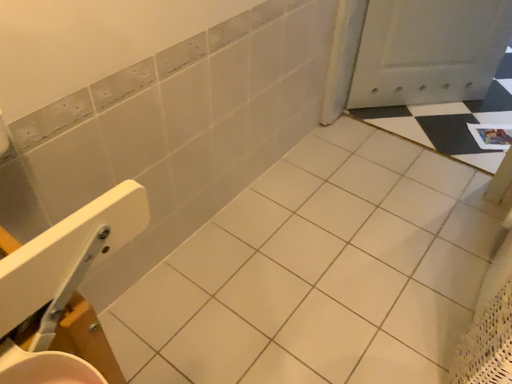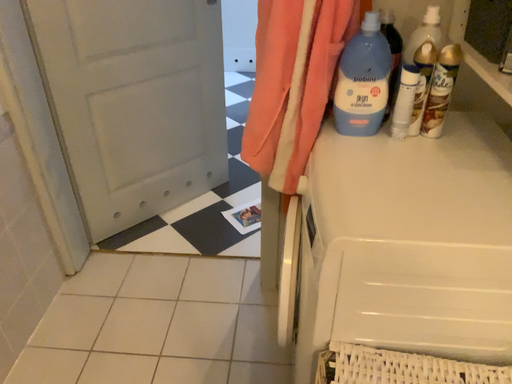
Question: Which way did the camera rotate in the video?

Choices:
 (A) rotated left
 (B) rotated right

Answer: (B)